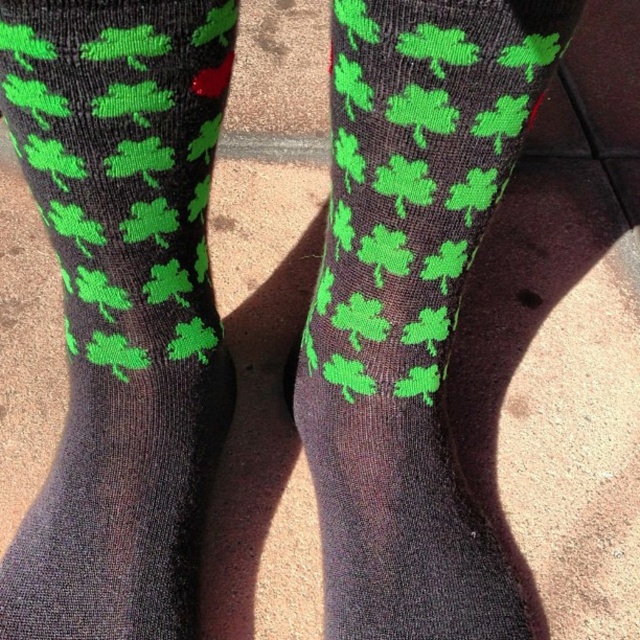
Which is behind, point (40, 0) or point (371, 522)?

The point (371, 522) is more distant.

Between matte black socks at left and matte black socks at center, which one has more height?

Standing taller between the two is matte black socks at center.

Describe the element at coordinates (122, 305) in the screenshot. I see `matte black socks at left` at that location.

This screenshot has width=640, height=640. Find the location of `matte black socks at left`. matte black socks at left is located at coordinates (122, 305).